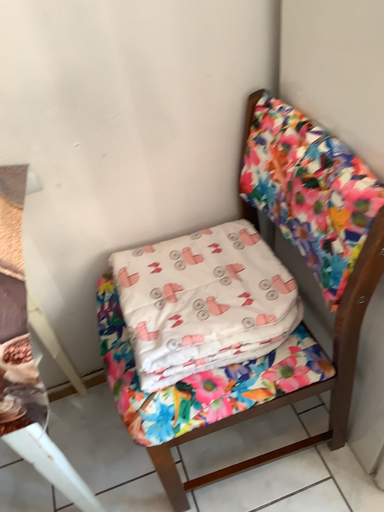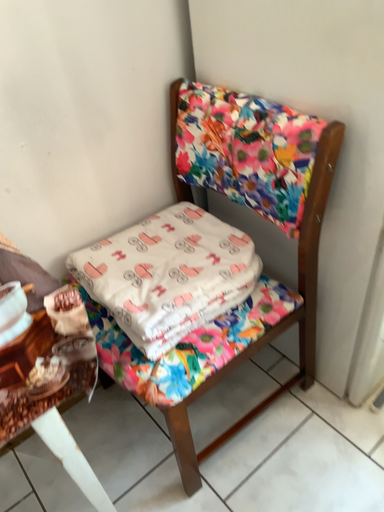
Question: Which way did the camera rotate in the video?

Choices:
 (A) rotated upward
 (B) rotated downward

Answer: (A)